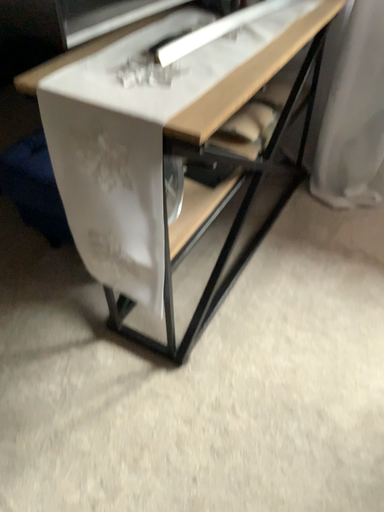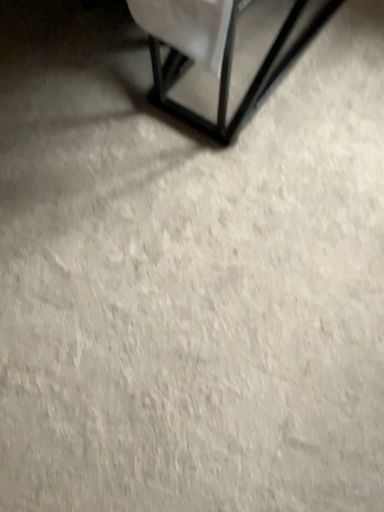
Question: Which way did the camera rotate in the video?

Choices:
 (A) rotated upward
 (B) rotated downward

Answer: (B)